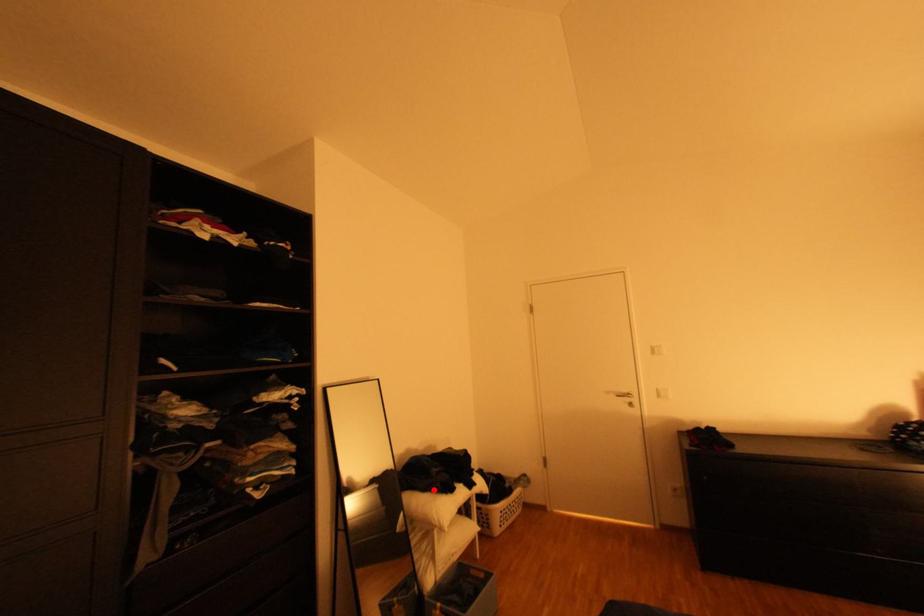
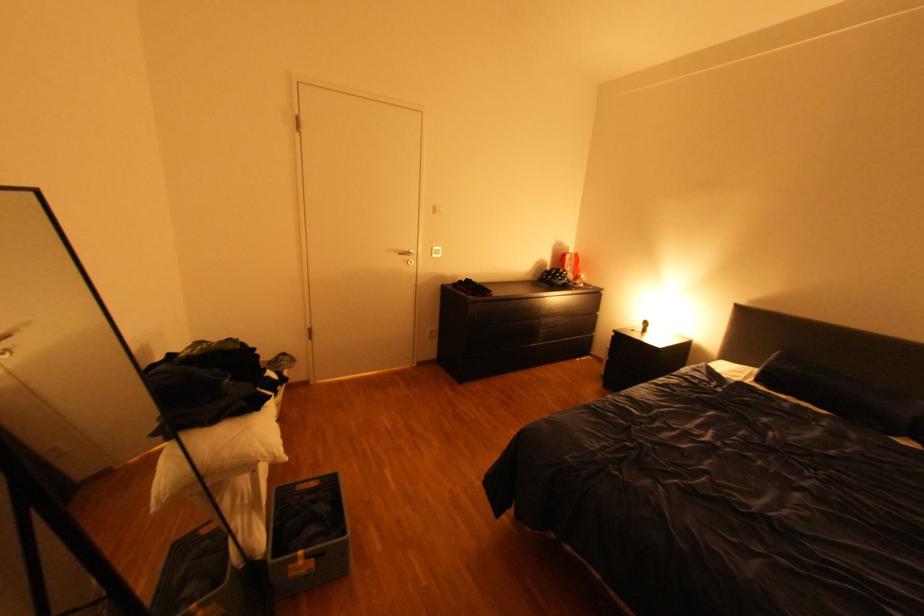
Question: I am providing you with two images of the same scene from different viewpoints. In image1, a red point is highlighted. Considering the same 3D point in image2, which of the following is correct?

Choices:
 (A) It is closer
 (B) It is farther

Answer: (A)